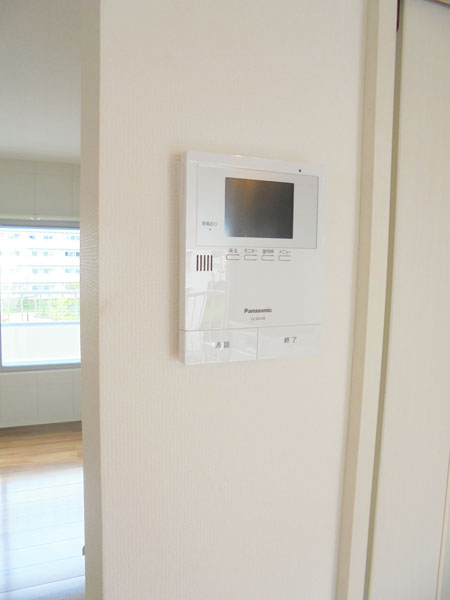
Find the location of a particular element. This screenshot has height=600, width=450. wall screen is located at coordinates (44, 286).